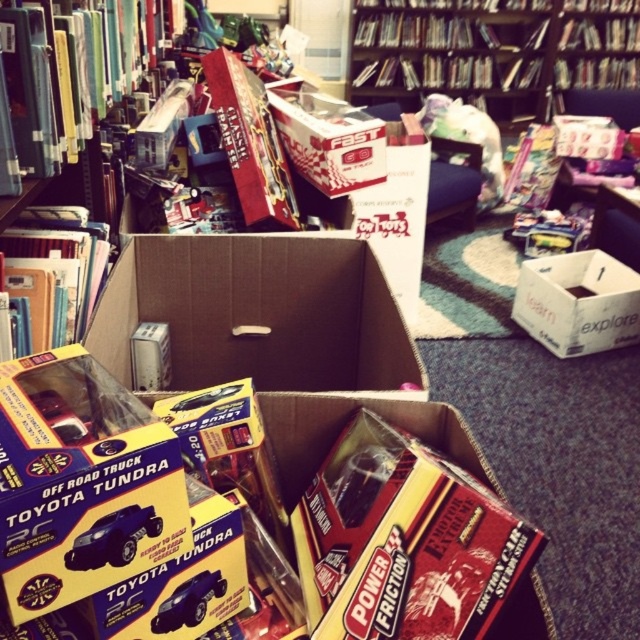
Is matte yellow toy truck at center wider than hardcover book at center?

Correct, the width of matte yellow toy truck at center exceeds that of hardcover book at center.

Based on the photo, is matte yellow toy truck at center shorter than hardcover book at center?

Correct, matte yellow toy truck at center is not as tall as hardcover book at center.

Looking at this image, measure the distance between matte yellow toy truck at center and camera.

matte yellow toy truck at center and camera are 18.89 inches apart from each other.

You are a GUI agent. You are given a task and a screenshot of the screen. Output one action in this format:
    pyautogui.click(x=<x>, y=<y>)
    Task: Click on the matte yellow toy truck at center
    
    Given the screenshot: What is the action you would take?
    97,497

Is wooden bookshelf at upper center further to camera compared to hardcover book at left?

Yes, it is.

This screenshot has width=640, height=640. In order to click on wooden bookshelf at upper center in this screenshot , I will do `click(493, 51)`.

In order to click on wooden bookshelf at upper center in this screenshot , I will do `click(493, 51)`.

Can you confirm if hardcover book at left is wider than shiny blue plastic toy truck at lower left?

Yes.

Which is more to the left, hardcover book at left or shiny blue plastic toy truck at lower left?

hardcover book at left is more to the left.

Does point (35, 248) lie behind point (102, 548)?

Yes.

Locate an element on the screen. This screenshot has width=640, height=640. hardcover book at left is located at coordinates (54, 273).